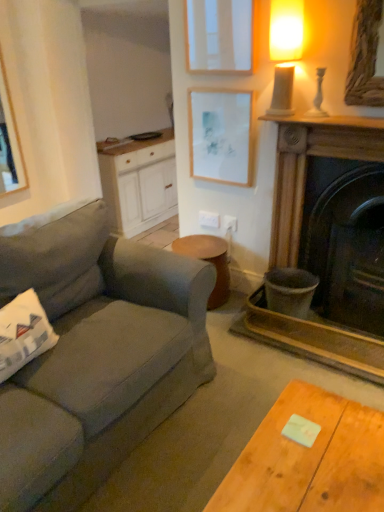
Question: Is white plastic power outlet at center, the second power outlet from the right, taller or shorter than white matte picture frame at upper center, the first picture frame in the top-to-bottom sequence?

Choices:
 (A) short
 (B) tall

Answer: (A)

Question: Looking at their shapes, would you say white plastic power outlet at center, the 1th power outlet when ordered from left to right, is wider or thinner than white matte picture frame at upper center, which is counted as the 2th picture frame, starting from the bottom?

Choices:
 (A) wide
 (B) thin

Answer: (B)

Question: Considering the real-world distances, which object is farthest from the matte white picture frame at upper center, which ranks as the 2th picture frame in top-to-bottom order?

Choices:
 (A) white plastic power outlet at center, the 1th power outlet when ordered from left to right
 (B) white matte picture frame at upper center, which is counted as the 2th picture frame, starting from the bottom
 (C) matte white candle at upper right
 (D) white wood cabinet at center
 (E) white plastic power outlet at center, the second power outlet in the left-to-right sequence

Answer: (D)

Question: Based on their relative distances, which object is nearer to the white matte picture frame at upper center, the first picture frame in the top-to-bottom sequence?

Choices:
 (A) matte white picture frame at upper center, which ranks as the 2th picture frame in top-to-bottom order
 (B) white plastic power outlet at center, the second power outlet in the left-to-right sequence
 (C) dark brown wood fireplace at right
 (D) wooden stool at center
 (E) matte white candle at upper right

Answer: (E)